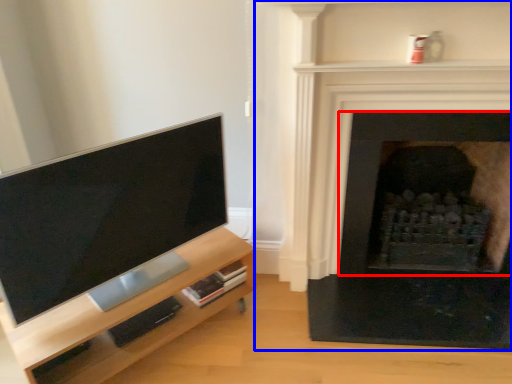
Question: Which object appears closest to the camera in this image, fireplace (highlighted by a red box) or fireplace (highlighted by a blue box)?

Choices:
 (A) fireplace
 (B) fireplace

Answer: (B)